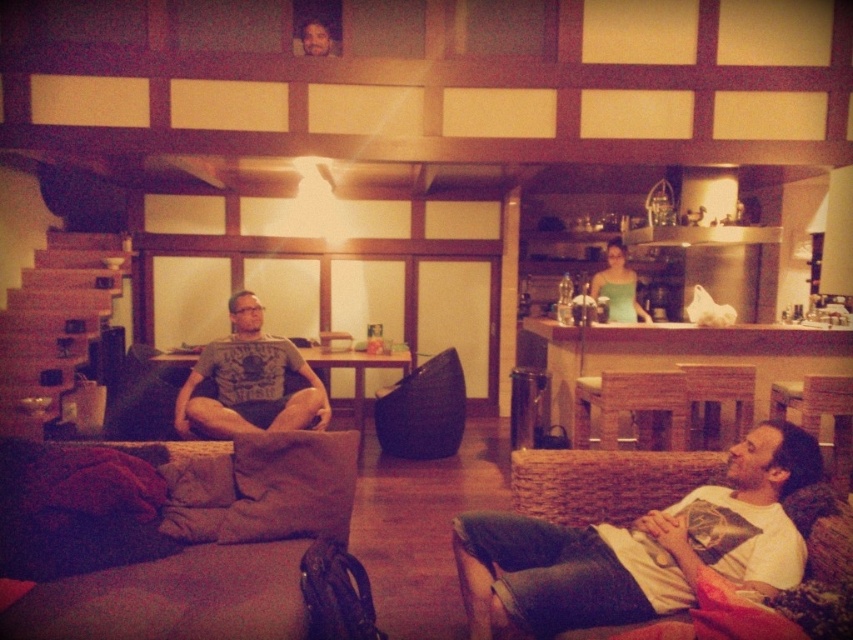
Which is more to the left, white cotton shirt at lower right or matte gray t-shirt at center?

Positioned to the left is matte gray t-shirt at center.

Can you confirm if white cotton shirt at lower right is positioned to the left of matte gray t-shirt at center?

Incorrect, white cotton shirt at lower right is not on the left side of matte gray t-shirt at center.

You are a GUI agent. You are given a task and a screenshot of the screen. Output one action in this format:
    pyautogui.click(x=<x>, y=<y>)
    Task: Click on the white cotton shirt at lower right
    The height and width of the screenshot is (640, 853).
    Given the screenshot: What is the action you would take?
    pyautogui.click(x=640, y=548)

Does white cotton shirt at lower right have a greater height compared to green matte tank top at center?

No, white cotton shirt at lower right is not taller than green matte tank top at center.

Who is more forward, (685, 552) or (616, 298)?

Point (685, 552)

Is point (593, 612) closer to camera compared to point (619, 237)?

Yes, it is.

Find the location of a particular element. This screenshot has width=853, height=640. white cotton shirt at lower right is located at coordinates (640, 548).

Can you confirm if dark gray fabric couch at lower left is thinner than white cotton shirt at lower right?

A: Incorrect, dark gray fabric couch at lower left's width is not less than white cotton shirt at lower right's.

Is point (216, 625) in front of point (456, 525)?

Yes.

Where is `dark gray fabric couch at lower left`? The height and width of the screenshot is (640, 853). dark gray fabric couch at lower left is located at coordinates 167,538.